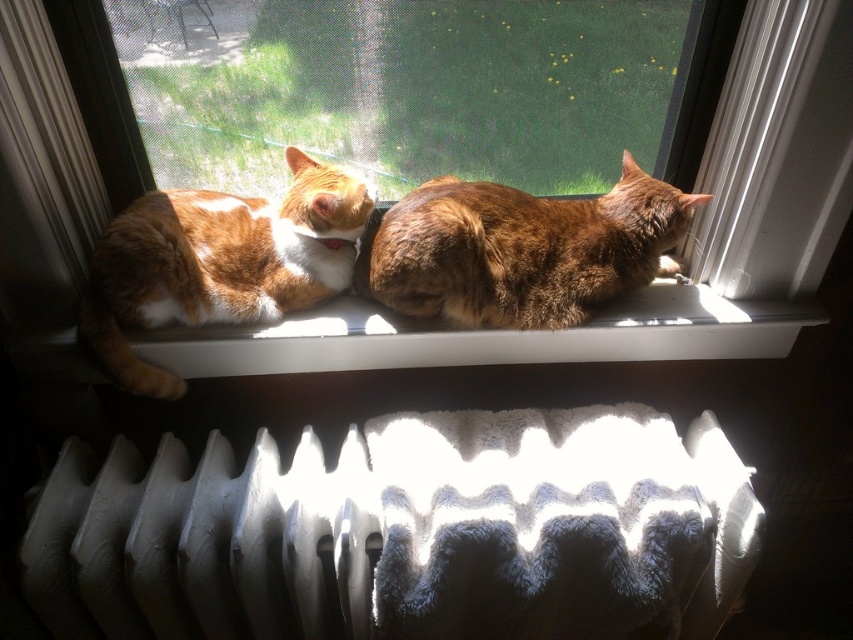
Question: Does white textured radiator at lower center have a greater width compared to white plastic window sill at center?

Choices:
 (A) no
 (B) yes

Answer: (A)

Question: Which object appears closest to the camera in this image?

Choices:
 (A) white plastic window sill at center
 (B) brown furry cat at center

Answer: (B)

Question: Is brown furry cat at center below orange fur cat at center?

Choices:
 (A) yes
 (B) no

Answer: (B)

Question: Is white textured radiator at lower center further to the viewer compared to orange fur cat at center?

Choices:
 (A) no
 (B) yes

Answer: (A)

Question: Which object is farther from the camera taking this photo?

Choices:
 (A) clear glass window at center
 (B) white plastic window sill at center
 (C) white textured radiator at lower center
 (D) white textured radiator at lower left

Answer: (B)

Question: Which of these objects is positioned closest to the brown furry cat at center?

Choices:
 (A) clear glass window at center
 (B) white textured radiator at lower left
 (C) orange fur cat at center

Answer: (A)